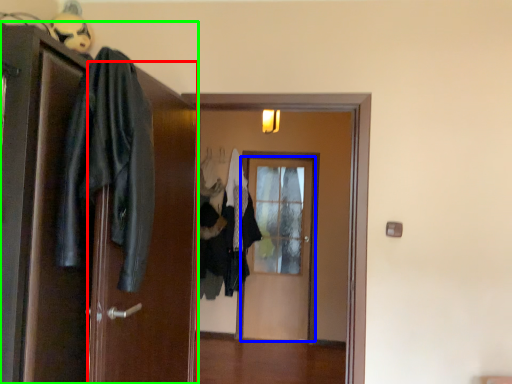
Question: Based on their relative distances, which object is nearer to screen door (highlighted by a red box)? Choose from door (highlighted by a blue box) and door (highlighted by a green box).

Choices:
 (A) door
 (B) door

Answer: (B)